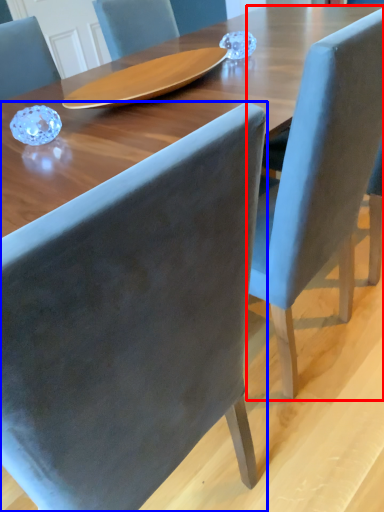
Question: Which object is further to the camera taking this photo, chair (highlighted by a red box) or chair (highlighted by a blue box)?

Choices:
 (A) chair
 (B) chair

Answer: (A)